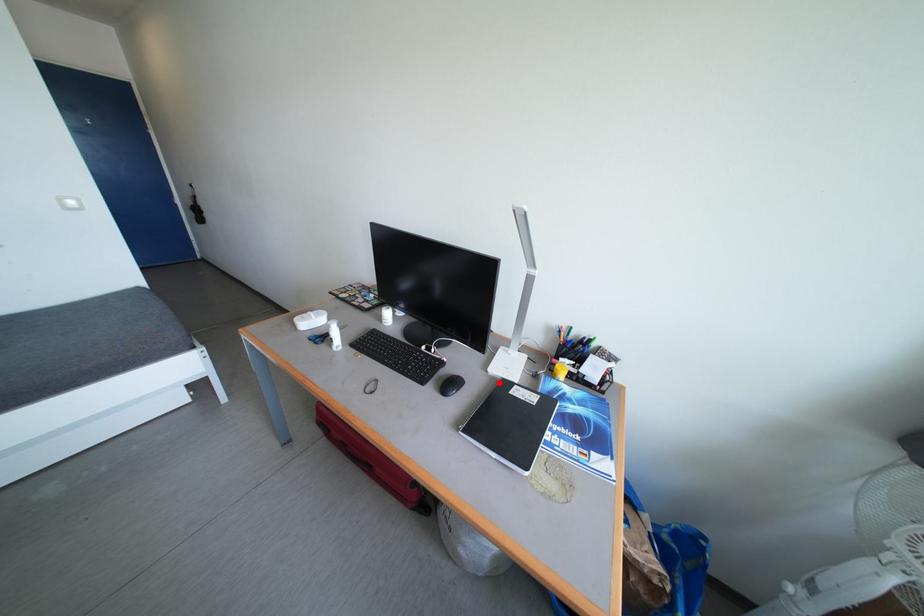
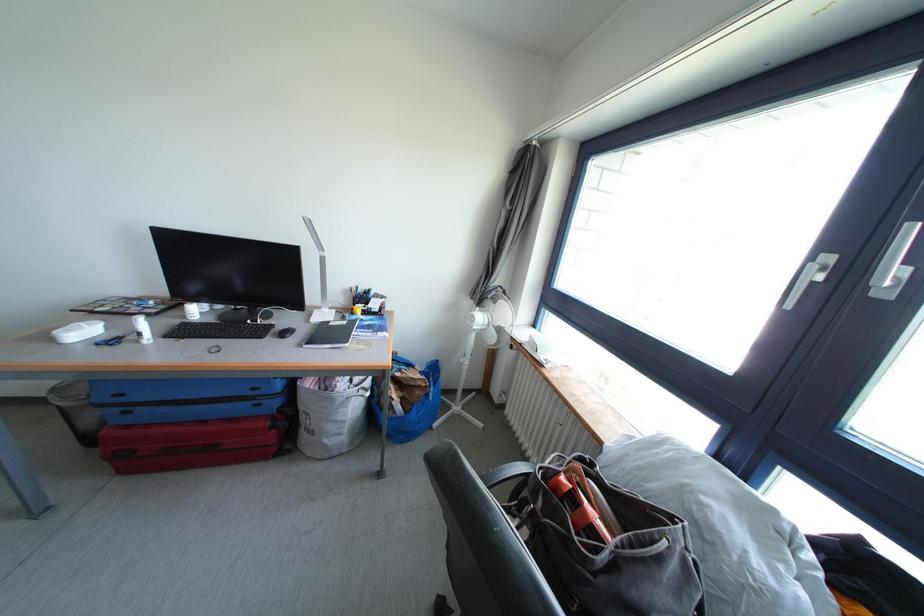
Locate, in the second image, the point that corresponds to the highlighted location in the first image.

(322, 329)